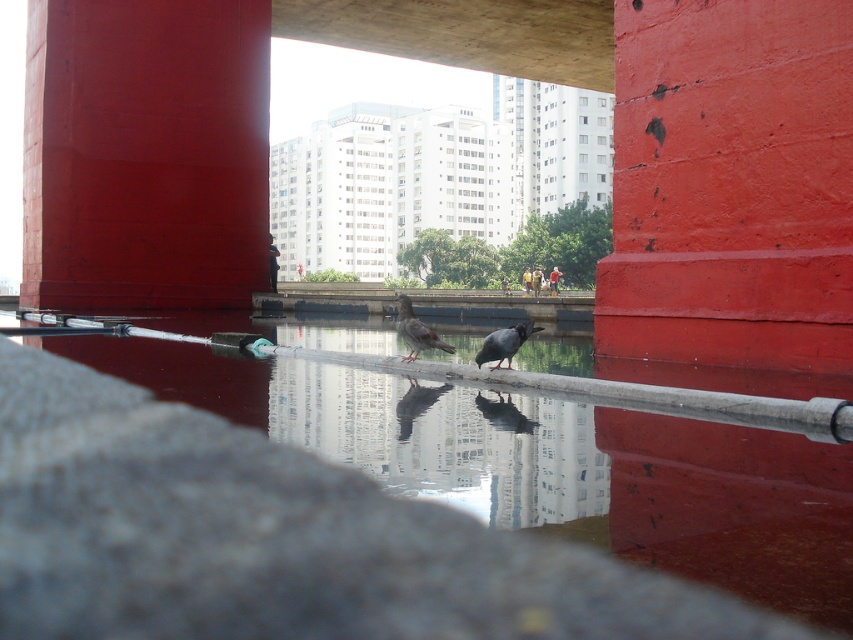
You are a photographer trying to capture the pigeons on the reflective water. You notice the smooth red pillar at upper left and the smooth concrete rail at center in your viewfinder. Which object is closer to you, the photographer?

The smooth red pillar at upper left is closer to you because the smooth concrete rail at center is behind it, indicating the pillar is in front.

You are standing under a red structure looking at the water. You see a smooth red paint at center and a matte gray bird at center. Which object is closer to you?

The matte gray bird at center is closer to you because the smooth red paint at center is positioned over it, indicating it is above and farther away.